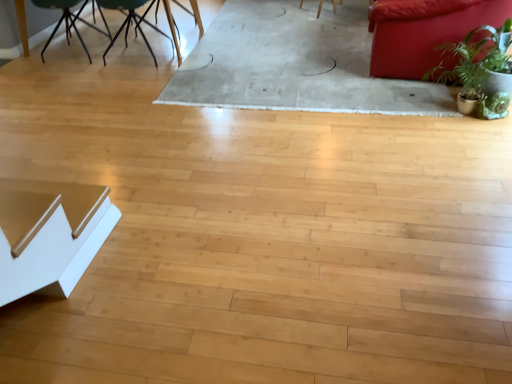
Question: Does matte red couch at upper right have a lesser width compared to metallic black table at upper left?

Choices:
 (A) yes
 (B) no

Answer: (B)

Question: Is the depth of matte red couch at upper right less than that of metallic black table at upper left?

Choices:
 (A) yes
 (B) no

Answer: (A)

Question: Does matte red couch at upper right have a greater height compared to metallic black table at upper left?

Choices:
 (A) yes
 (B) no

Answer: (A)

Question: Can you confirm if matte red couch at upper right is bigger than metallic black table at upper left?

Choices:
 (A) no
 (B) yes

Answer: (A)

Question: Is matte red couch at upper right further to camera compared to metallic black table at upper left?

Choices:
 (A) yes
 (B) no

Answer: (B)

Question: Does matte red couch at upper right appear on the left side of metallic black table at upper left?

Choices:
 (A) yes
 (B) no

Answer: (B)

Question: Is white glossy table at lower left shorter than matte red couch at upper right?

Choices:
 (A) no
 (B) yes

Answer: (B)

Question: Considering the relative sizes of white glossy table at lower left and matte red couch at upper right in the image provided, is white glossy table at lower left thinner than matte red couch at upper right?

Choices:
 (A) yes
 (B) no

Answer: (A)

Question: From the image's perspective, is white glossy table at lower left over matte red couch at upper right?

Choices:
 (A) yes
 (B) no

Answer: (B)

Question: Can you confirm if white glossy table at lower left is taller than matte red couch at upper right?

Choices:
 (A) no
 (B) yes

Answer: (A)

Question: Is white glossy table at lower left positioned in front of matte red couch at upper right?

Choices:
 (A) yes
 (B) no

Answer: (A)

Question: Is white glossy table at lower left oriented away from matte red couch at upper right?

Choices:
 (A) yes
 (B) no

Answer: (B)

Question: Is the position of metallic black table at upper left more distant than that of matte red couch at upper right?

Choices:
 (A) yes
 (B) no

Answer: (A)